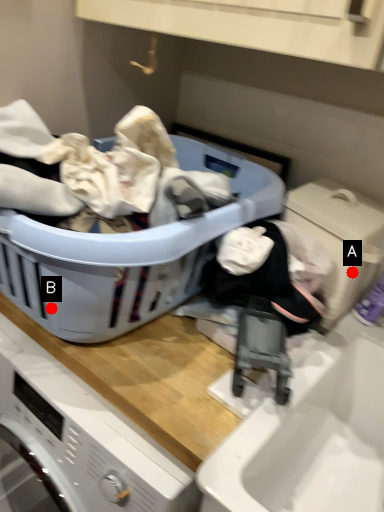
Question: Two points are circled on the image, labeled by A and B beside each circle. Which point is closer to the camera?

Choices:
 (A) A is closer
 (B) B is closer

Answer: (B)